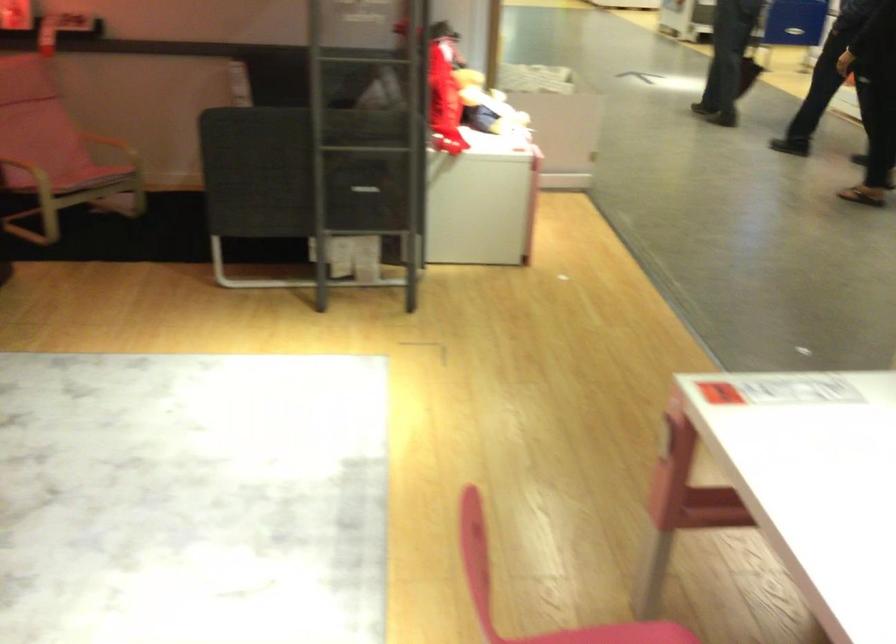
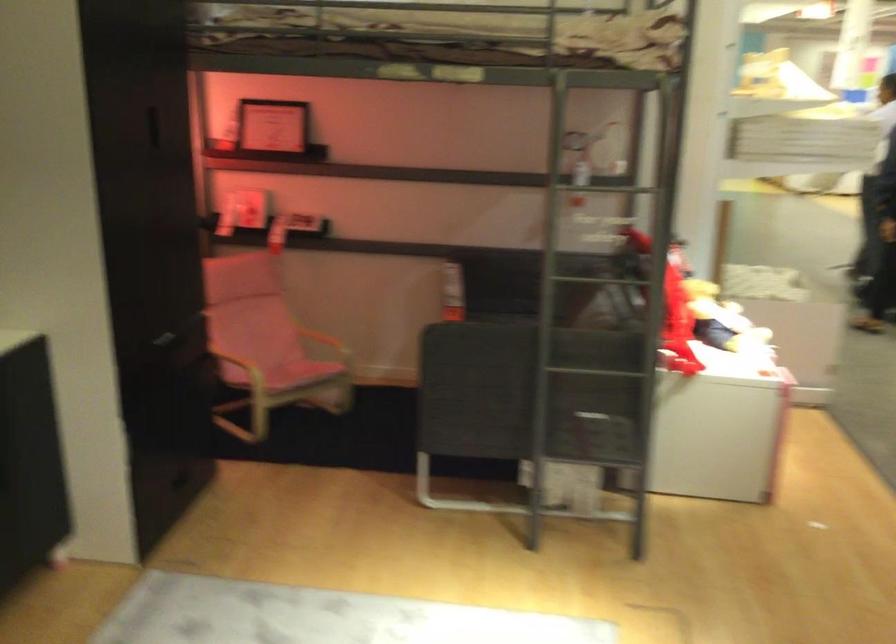
Question: The images are taken continuously from a first-person perspective. In which direction is your viewpoint rotating?

Choices:
 (A) Left
 (B) Right
 (C) Up
 (D) Down

Answer: (A)